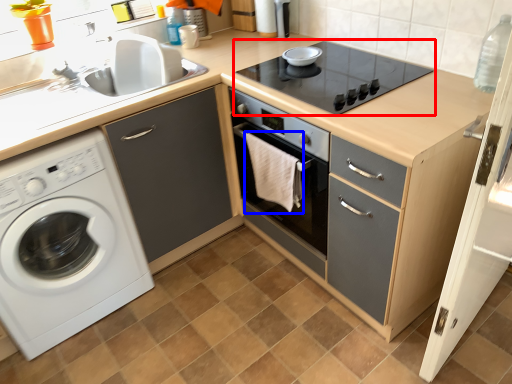
Question: Which object appears farthest to the camera in this image, gas stove (highlighted by a red box) or material (highlighted by a blue box)?

Choices:
 (A) gas stove
 (B) material

Answer: (B)